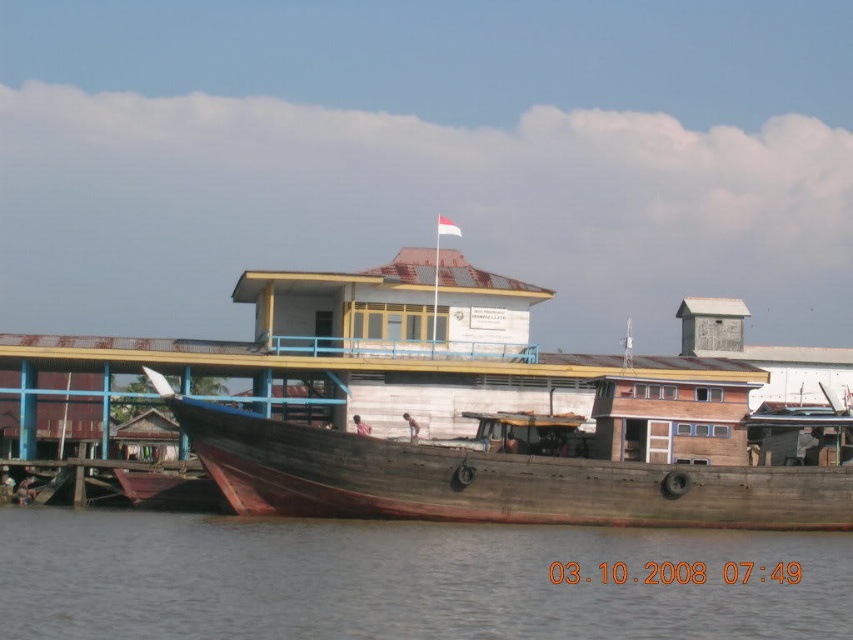
You are standing on the pier and notice the brown water at lower center and the wooden boat at center. Which object is closer to the ground level?

The brown water at lower center is closer to the ground level because it is located below the wooden boat at center.

You are standing on the pier and want to board the wooden boat at center. Which direction should you move to reach it from the brown water at lower center?

The brown water at lower center is in front of the wooden boat at center, so you should move backward to reach the wooden boat at center from the brown water at lower center.

You are a photographer planning to take a photo of the waterfront scene. You want to ensure that both the brown water at lower center and the wooden boat at center are clearly visible in the frame. Based on their sizes, which object should you focus on to ensure both are in focus?

The brown water at lower center has a smaller size compared to the wooden boat at center. To ensure both are in focus, you should focus on the wooden boat at center since it is larger and will require more precise focusing to capture details, while the smaller brown water at lower center will naturally be within the depth of field.